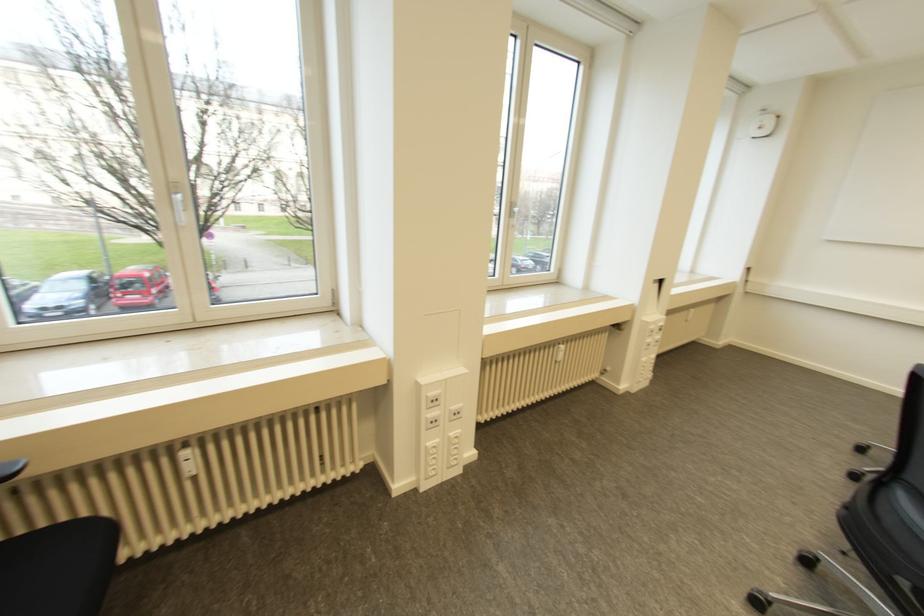
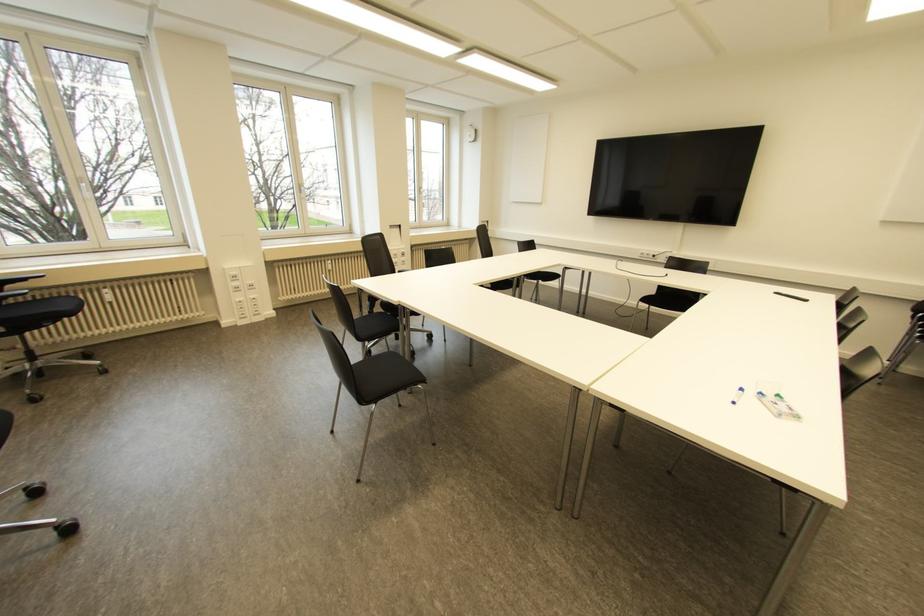
Where in the second image is the point corresponding to the point at 185,453 from the first image?

(104, 290)